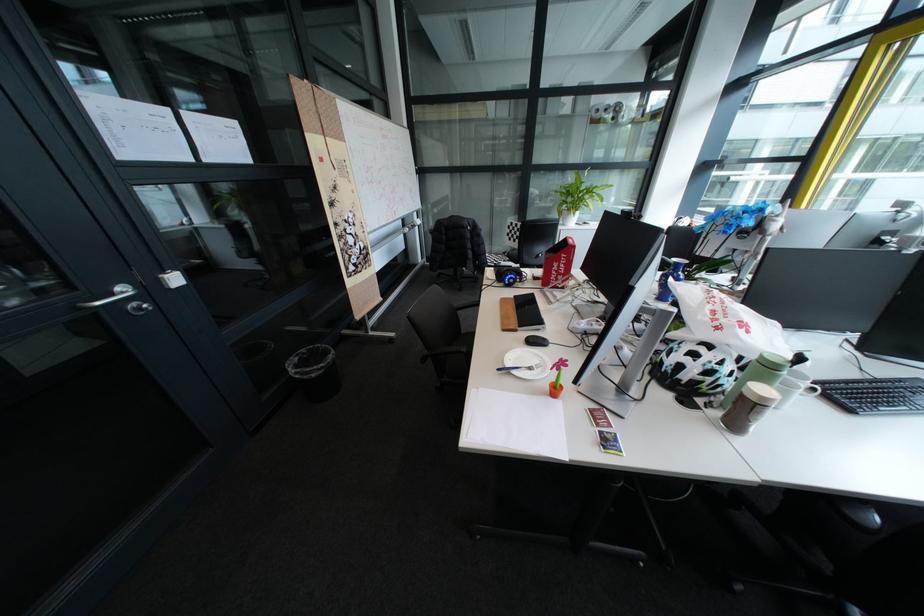
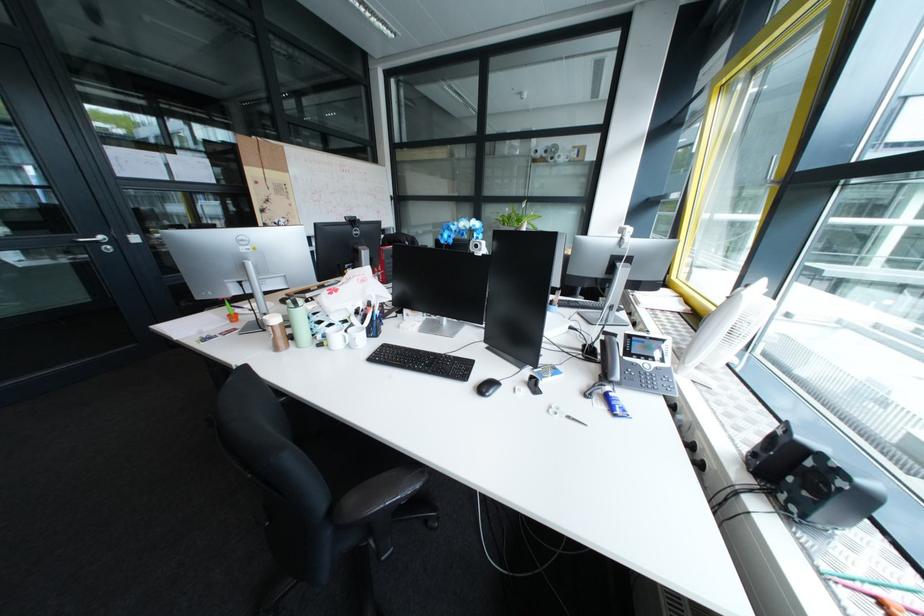
Where in the second image is the point corresponding to point (128, 294) from the first image?

(107, 238)